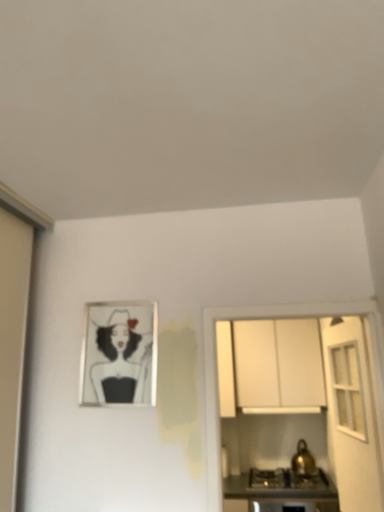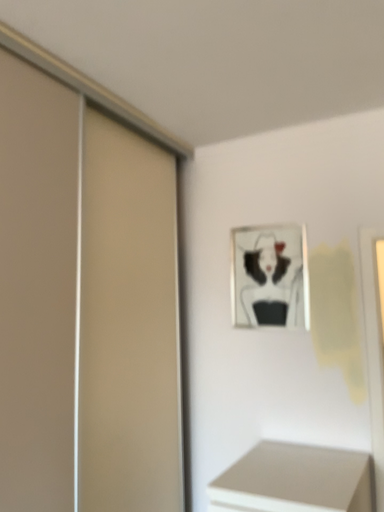
Question: How did the camera likely rotate when shooting the video?

Choices:
 (A) rotated upward
 (B) rotated downward

Answer: (B)